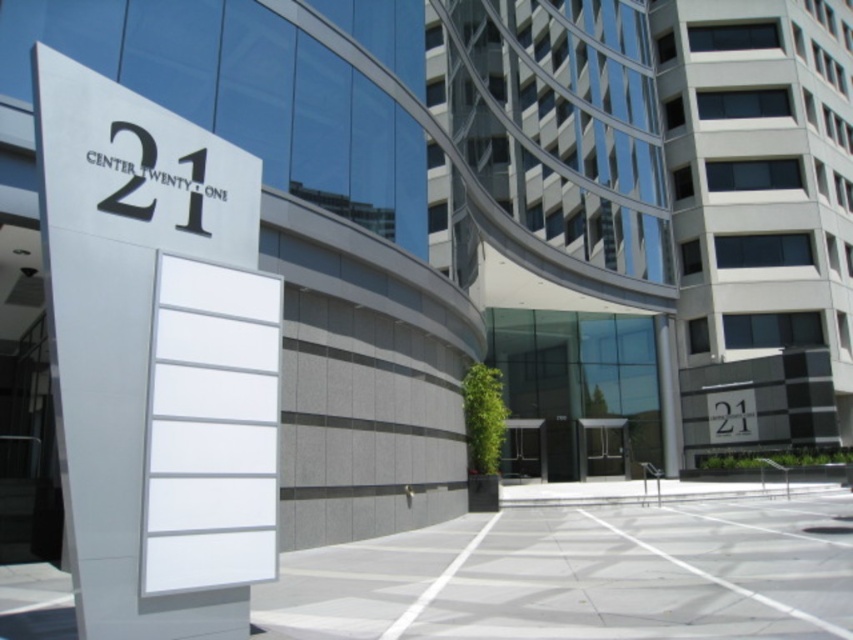
Question: From the image, what is the correct spatial relationship of white glossy sign at center in relation to glass door at center?

Choices:
 (A) right
 (B) left

Answer: (B)

Question: Does white glossy sign at center have a lesser width compared to transparent glass door at center?

Choices:
 (A) yes
 (B) no

Answer: (A)

Question: Which point is closer to the camera taking this photo?

Choices:
 (A) (601, 440)
 (B) (541, 426)
 (C) (120, 195)

Answer: (C)

Question: Estimate the real-world distances between objects in this image. Which object is closer to the white glossy sign at center?

Choices:
 (A) transparent glass door at center
 (B) glass door at center

Answer: (B)

Question: Does white glossy sign at center have a smaller size compared to transparent glass door at center?

Choices:
 (A) yes
 (B) no

Answer: (A)

Question: Among these objects, which one is farthest from the camera?

Choices:
 (A) white glossy sign at center
 (B) transparent glass door at center

Answer: (B)